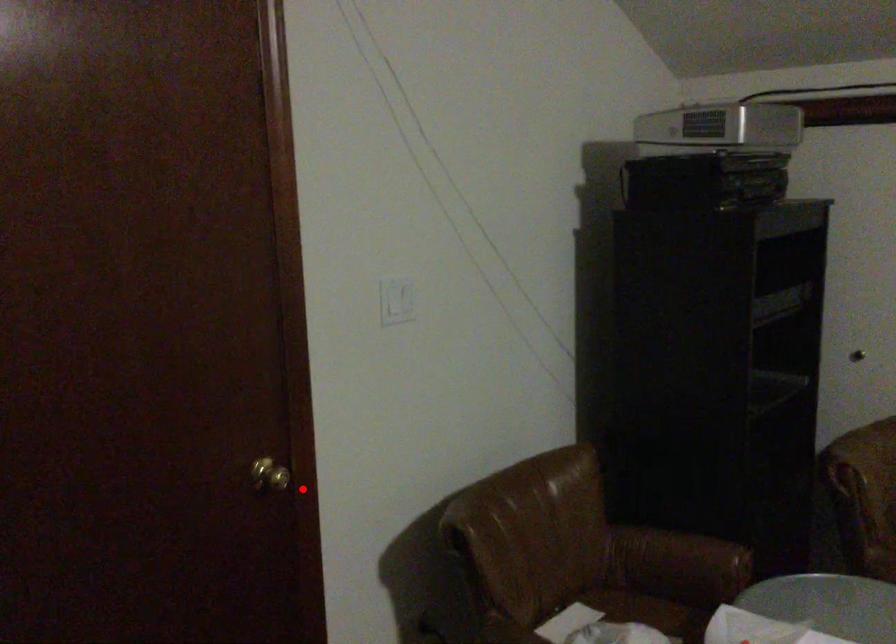
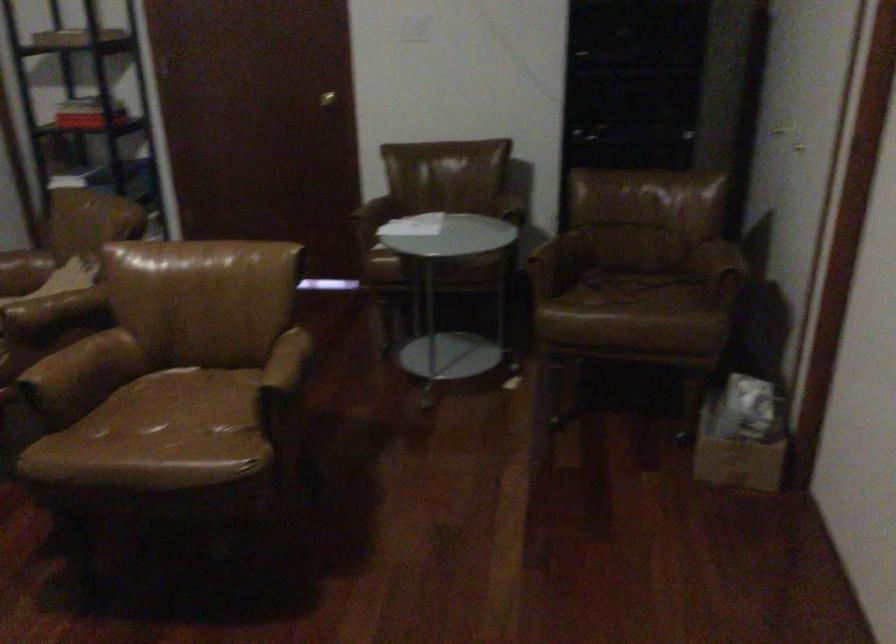
The point at the highlighted location is marked in the first image. Where is the corresponding point in the second image?

(326, 99)